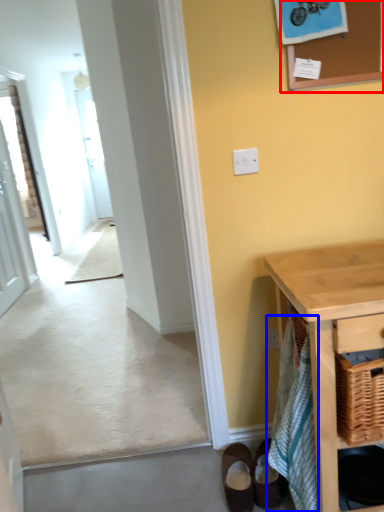
Question: Which object appears farthest to the camera in this image, bulletin board (highlighted by a red box) or bath towel (highlighted by a blue box)?

Choices:
 (A) bulletin board
 (B) bath towel

Answer: (A)